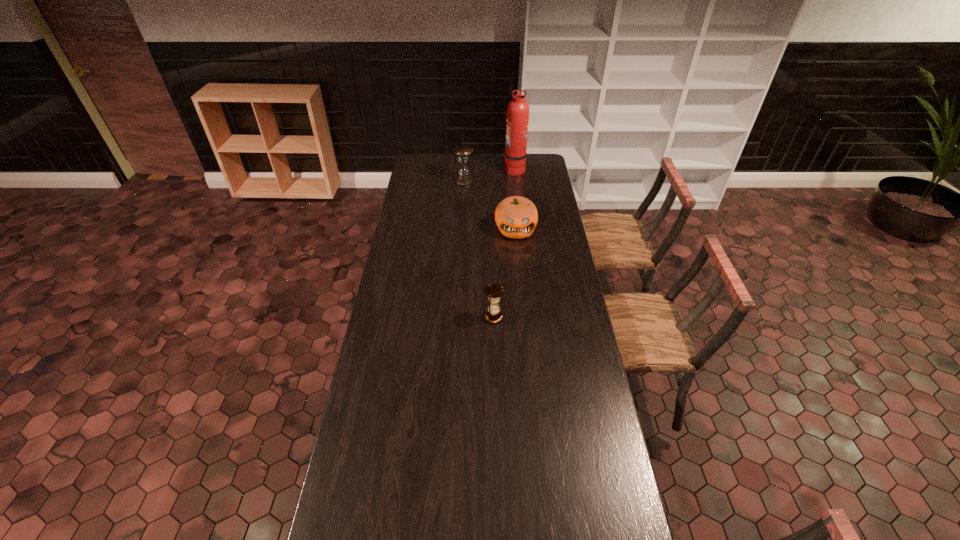
This screenshot has height=540, width=960. I want to click on free space located 0.320m on the face of the pumpkin, so click(x=521, y=287).

Where is `vacant space situated 0.210m on the left of the right hourglass`? vacant space situated 0.210m on the left of the right hourglass is located at coordinates (432, 317).

Find the location of a particular element. object that is at the far edge is located at coordinates (517, 120).

Locate an element on the screen. fire extinguisher at the right edge is located at coordinates (517, 120).

Locate an element on the screen. pumpkin located at the right edge is located at coordinates (516, 217).

I want to click on object positioned at the far right corner, so click(x=517, y=120).

You are a GUI agent. You are given a task and a screenshot of the screen. Output one action in this format:
    pyautogui.click(x=<x>, y=<y>)
    Task: Click on the blank space at the left edge of the desktop
    The image size is (960, 540).
    Given the screenshot: What is the action you would take?
    pyautogui.click(x=398, y=234)

Image resolution: width=960 pixels, height=540 pixels. Find the location of `vacant space at the right edge of the desktop`. vacant space at the right edge of the desktop is located at coordinates (576, 460).

Image resolution: width=960 pixels, height=540 pixels. In the image, there is a desktop. In order to click on free space at the far right corner in this screenshot , I will do `click(534, 157)`.

Where is `free spot between the tallest object and the nearest object`? This screenshot has height=540, width=960. free spot between the tallest object and the nearest object is located at coordinates (504, 243).